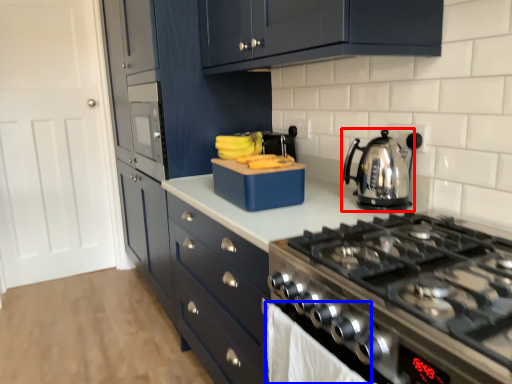
Question: Which object appears farthest to the camera in this image, kettle (highlighted by a red box) or cloth (highlighted by a blue box)?

Choices:
 (A) kettle
 (B) cloth

Answer: (A)